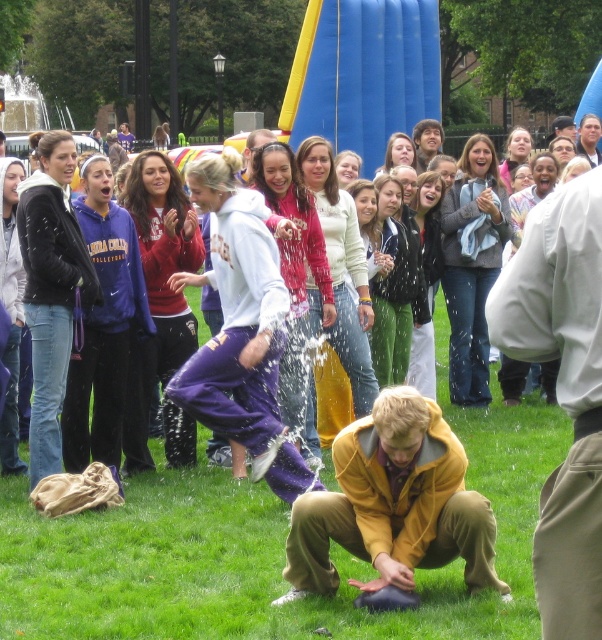
Is green grass at lower center smaller than smooth brown hair at upper center?

Actually, green grass at lower center might be larger than smooth brown hair at upper center.

Where is `green grass at lower center`? green grass at lower center is located at coordinates (262, 552).

Identify the location of green grass at lower center. (262, 552).

I want to click on yellow matte jacket at lower center, so click(393, 504).

Who is lower down, yellow matte jacket at lower center or smooth brown hair at upper center?

yellow matte jacket at lower center is lower down.

Is point (332, 461) behind point (424, 138)?

No, it is in front of (424, 138).

At what (x,y) coordinates should I click in order to perform the action: click on yellow matte jacket at lower center. Please return your answer as a coordinate pair (x, y). This screenshot has width=602, height=640. Looking at the image, I should click on (393, 504).

Which is in front, point (541, 355) or point (579, 152)?

Point (541, 355) is in front.

Between light brown cotton pants at lower right and smooth gray hoodie at upper right, which one has more height?

light brown cotton pants at lower right is taller.

Who is more forward, (538, 236) or (594, 134)?

Point (538, 236)

Image resolution: width=602 pixels, height=640 pixels. In order to click on light brown cotton pants at lower right in this screenshot , I will do `click(562, 392)`.